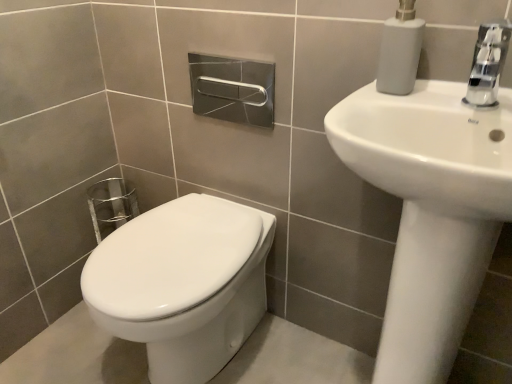
Question: From a real-world perspective, does chrome metallic faucet at upper right stand above white matte soap dispenser at upper right?

Choices:
 (A) yes
 (B) no

Answer: (B)

Question: Is the depth of chrome metallic faucet at upper right greater than that of white matte soap dispenser at upper right?

Choices:
 (A) yes
 (B) no

Answer: (B)

Question: Can you confirm if chrome metallic faucet at upper right is thinner than white matte soap dispenser at upper right?

Choices:
 (A) no
 (B) yes

Answer: (A)

Question: Considering the relative sizes of chrome metallic faucet at upper right and white matte soap dispenser at upper right in the image provided, is chrome metallic faucet at upper right wider than white matte soap dispenser at upper right?

Choices:
 (A) no
 (B) yes

Answer: (B)

Question: Can you confirm if chrome metallic faucet at upper right is positioned to the right of white matte soap dispenser at upper right?

Choices:
 (A) yes
 (B) no

Answer: (A)

Question: From a real-world perspective, is chrome metallic faucet at upper right located beneath white matte soap dispenser at upper right?

Choices:
 (A) yes
 (B) no

Answer: (A)

Question: Does chrome metallic faucet at upper right have a larger size compared to white glossy sink at upper right?

Choices:
 (A) no
 (B) yes

Answer: (A)

Question: Is chrome metallic faucet at upper right positioned in front of white glossy sink at upper right?

Choices:
 (A) no
 (B) yes

Answer: (A)

Question: Is chrome metallic faucet at upper right to the right of white glossy sink at upper right from the viewer's perspective?

Choices:
 (A) yes
 (B) no

Answer: (A)

Question: From a real-world perspective, is chrome metallic faucet at upper right positioned over white glossy sink at upper right based on gravity?

Choices:
 (A) yes
 (B) no

Answer: (A)

Question: From the image's perspective, does chrome metallic faucet at upper right appear lower than white glossy sink at upper right?

Choices:
 (A) yes
 (B) no

Answer: (B)

Question: Is there a large distance between chrome metallic faucet at upper right and white glossy sink at upper right?

Choices:
 (A) yes
 (B) no

Answer: (B)

Question: From a real-world perspective, is white glossy sink at upper right on white matte soap dispenser at upper right?

Choices:
 (A) no
 (B) yes

Answer: (A)